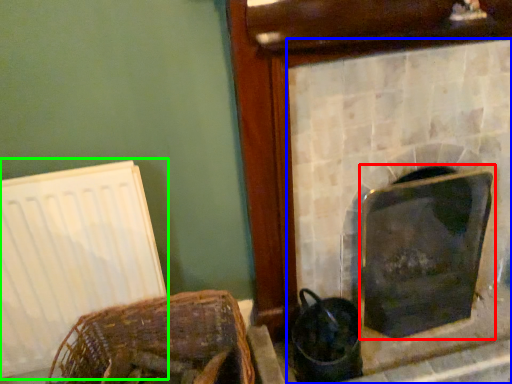
Question: Which object is the farthest from fireplace (highlighted by a red box)? Choose among these: fireplace (highlighted by a blue box) or radiator (highlighted by a green box).

Choices:
 (A) fireplace
 (B) radiator

Answer: (B)